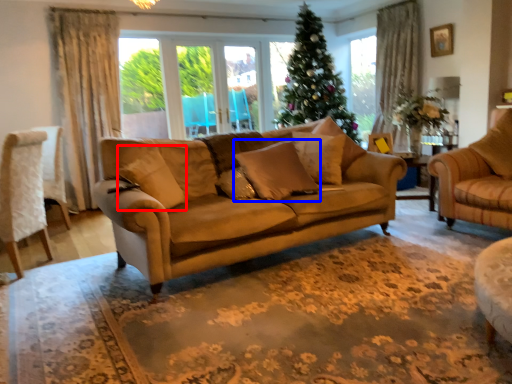
Question: Which point is closer to the camera, pillow (highlighted by a red box) or pillow (highlighted by a blue box)?

Choices:
 (A) pillow
 (B) pillow

Answer: (A)